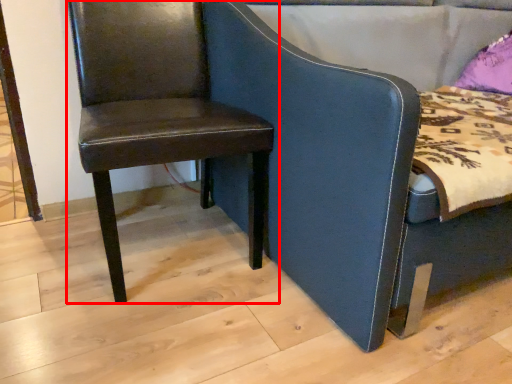
Question: From the image's perspective, where is chair (annotated by the red box) located relative to chair?

Choices:
 (A) below
 (B) above

Answer: (A)